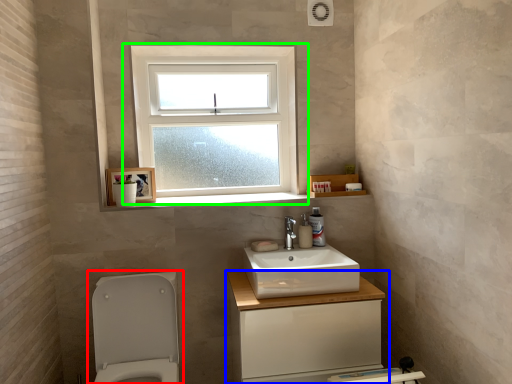
Question: Estimate the real-world distances between objects in this image. Which object is farther from toilet (highlighted by a red box), bathroom cabinet (highlighted by a blue box) or window (highlighted by a green box)?

Choices:
 (A) bathroom cabinet
 (B) window

Answer: (B)